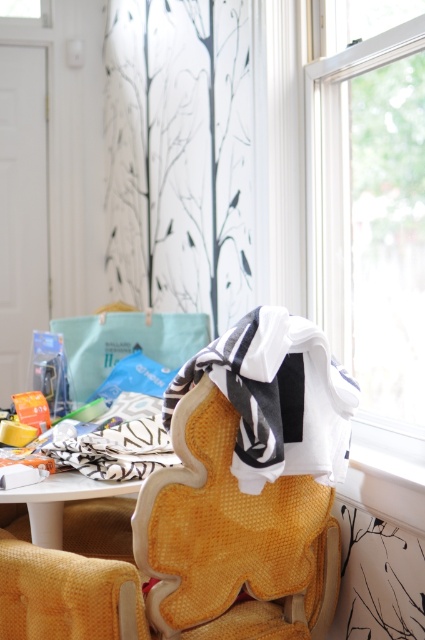
Question: Considering the real-world distances, which object is farthest from the transparent glass window at upper right?

Choices:
 (A) white cotton blanket at center
 (B) woven fabric armchair at lower left

Answer: (B)

Question: Can you confirm if transparent glass window at upper right is positioned to the left of white cotton blanket at center?

Choices:
 (A) yes
 (B) no

Answer: (B)

Question: Among these points, which one is farthest from the camera?

Choices:
 (A) (320, 424)
 (B) (343, 246)
 (C) (28, 493)

Answer: (B)

Question: Which point is farther to the camera?

Choices:
 (A) white glossy table at center
 (B) woven fabric armchair at lower left
 (C) white cotton blanket at center

Answer: (A)

Question: Can you confirm if woven fabric armchair at lower left is positioned to the right of transparent glass window at upper right?

Choices:
 (A) yes
 (B) no

Answer: (B)

Question: Is woven fabric armchair at lower left bigger than white glossy table at center?

Choices:
 (A) yes
 (B) no

Answer: (A)